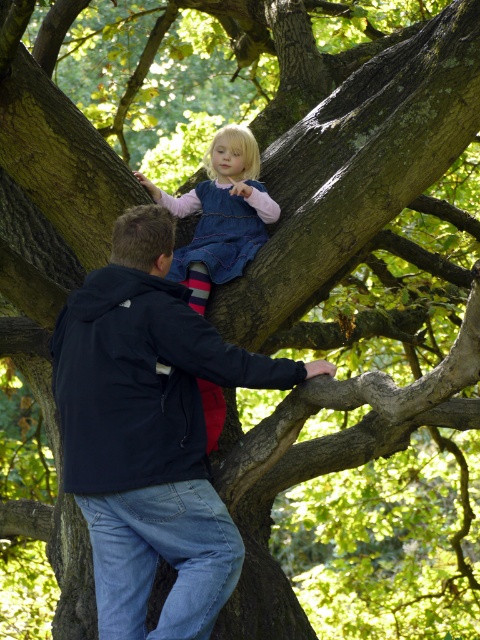
Is dark blue jacket at upper center below denim dress at upper center?

Indeed, dark blue jacket at upper center is positioned under denim dress at upper center.

Is dark blue jacket at upper center taller than denim dress at upper center?

Yes, dark blue jacket at upper center is taller than denim dress at upper center.

Locate an element on the screen. dark blue jacket at upper center is located at coordinates (149, 433).